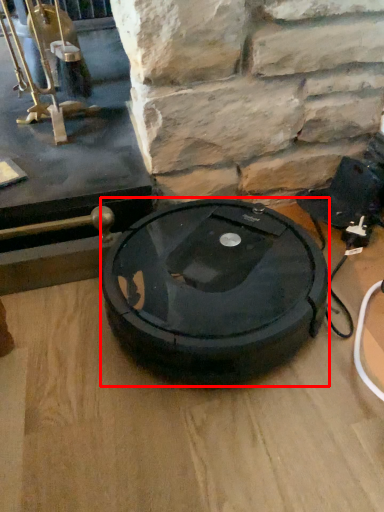
Question: Considering the relative positions of car tire (annotated by the red box) and table top in the image provided, where is car tire (annotated by the red box) located with respect to the staircase?

Choices:
 (A) right
 (B) left

Answer: (A)